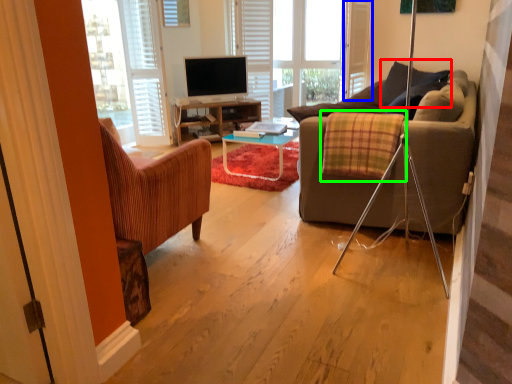
Question: Which is nearer to the pillow (highlighted by a red box)? screen door (highlighted by a blue box) or plaid (highlighted by a green box).

Choices:
 (A) screen door
 (B) plaid

Answer: (B)